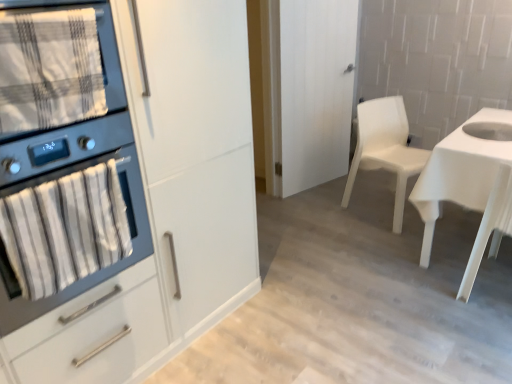
You are a GUI agent. You are given a task and a screenshot of the screen. Output one action in this format:
    pyautogui.click(x=<x>, y=<y>)
    Task: Click on the white glossy desk at right
    
    Given the screenshot: What is the action you would take?
    pyautogui.click(x=470, y=185)

The width and height of the screenshot is (512, 384). In order to click on plaid fabric towel at left in this screenshot , I will do pyautogui.click(x=49, y=69).

Where is `white matte door at center`? This screenshot has width=512, height=384. white matte door at center is located at coordinates (315, 90).

Where is `matte black oven at left`? The width and height of the screenshot is (512, 384). matte black oven at left is located at coordinates (89, 275).

Is white glossy sink at right oriented towards white matte door at center?

Yes, white glossy sink at right is oriented towards white matte door at center.

You are a GUI agent. You are given a task and a screenshot of the screen. Output one action in this format:
    pyautogui.click(x=<x>, y=<y>)
    Task: Click on the sink located on the right of white matte door at center
    The image size is (512, 384).
    Given the screenshot: What is the action you would take?
    pyautogui.click(x=489, y=131)

Can you confirm if white glossy sink at right is smaller than white matte door at center?

Indeed, white glossy sink at right has a smaller size compared to white matte door at center.

Would you say white glossy sink at right is a long distance from white matte door at center?

That's right, there is a large distance between white glossy sink at right and white matte door at center.

Do you think white matte cabinet at left is within plaid fabric towel at left, or outside of it?

white matte cabinet at left exists outside the volume of plaid fabric towel at left.

Relative to plaid fabric towel at left, is white matte cabinet at left in front or behind?

Visually, white matte cabinet at left is located in front of plaid fabric towel at left.

Is white matte cabinet at left next to plaid fabric towel at left and touching it?

No.

Find the location of a particular element. blanket to the left of white glossy sink at right is located at coordinates (49, 69).

Does point (48, 123) lie behind point (472, 128)?

No.

Is plaid fabric towel at left wider or thinner than white glossy sink at right?

Considering their sizes, plaid fabric towel at left looks slimmer than white glossy sink at right.

Is white glossy sink at right at the back of plaid fabric towel at left?

No, white glossy sink at right is not at the back of plaid fabric towel at left.

Is white plastic chair at center-right oriented towards white matte cabinet at left?

No, white plastic chair at center-right is not turned towards white matte cabinet at left.

Considering the relative sizes of white plastic chair at center-right and white matte cabinet at left in the image provided, is white plastic chair at center-right taller than white matte cabinet at left?

No.

From the image's perspective, is white plastic chair at center-right over white matte cabinet at left?

Correct, white plastic chair at center-right appears higher than white matte cabinet at left in the image.

Consider the image. Does white plastic chair at center-right come behind white matte cabinet at left?

Yes, it is.

Is matte black oven at left far away from white plastic chair at center-right?

matte black oven at left is far away from white plastic chair at center-right.

From the image's perspective, which one is positioned lower, matte black oven at left or white plastic chair at center-right?

matte black oven at left.

Is matte black oven at left closer to camera compared to white plastic chair at center-right?

Yes, it is.

Is matte black oven at left spatially inside white plastic chair at center-right, or outside of it?

The correct answer is: outside.

Based on the photo, from the image's perspective, would you say white matte cabinet at left is positioned over white glossy desk at right?

Indeed, from the image's perspective, white matte cabinet at left is shown above white glossy desk at right.

Can you confirm if white matte cabinet at left is thinner than white glossy desk at right?

No, white matte cabinet at left is not thinner than white glossy desk at right.

Is point (205, 17) behind point (478, 263)?

No, it is not.

From a real-world perspective, who is located higher, white matte cabinet at left or white glossy desk at right?

From a 3D spatial view, white matte cabinet at left is above.

Does matte black oven at left turn towards white matte cabinet at left?

Yes, matte black oven at left is turned towards white matte cabinet at left.

Which is more to the right, matte black oven at left or white matte cabinet at left?

Positioned to the right is white matte cabinet at left.

How many degrees apart are the facing directions of matte black oven at left and white matte cabinet at left?

The angle between the facing direction of matte black oven at left and the facing direction of white matte cabinet at left is 0.000998 degrees.

Is matte black oven at left not close to white matte cabinet at left?

No, matte black oven at left is not far from white matte cabinet at left.

The height and width of the screenshot is (384, 512). I want to click on sink in front of the white matte door at center, so click(x=489, y=131).

This screenshot has width=512, height=384. I want to click on blanket on the left of the white matte cabinet at left, so [x=49, y=69].

Estimate the real-world distances between objects in this image. Which object is closer to white glossy desk at right, matte black oven at left or white matte cabinet at left?

white matte cabinet at left lies closer to white glossy desk at right than the other object.

When comparing their distances from white matte cabinet at left, does white glossy desk at right or plaid fabric towel at left seem closer?

The object closer to white matte cabinet at left is plaid fabric towel at left.

Looking at the image, which one is located closer to white matte door at center, white glossy desk at right or plaid fabric towel at left?

white glossy desk at right lies closer to white matte door at center than the other object.

Looking at the image, which one is located further to white glossy sink at right, matte black oven at left or white glossy desk at right?

matte black oven at left.

Looking at the image, which one is located further to white plastic chair at center-right, plaid fabric towel at left or white glossy sink at right?

Among the two, plaid fabric towel at left is located further to white plastic chair at center-right.

Estimate the real-world distances between objects in this image. Which object is further from white glossy desk at right, white glossy sink at right or plaid fabric towel at left?

plaid fabric towel at left is positioned further to the anchor white glossy desk at right.

Looking at this image, estimate the real-world distances between objects in this image. Which object is closer to plaid fabric towel at left, white glossy sink at right or matte black oven at left?

The object closer to plaid fabric towel at left is matte black oven at left.

From the image, which object appears to be farther from white matte door at center, white glossy desk at right or white matte cabinet at left?

white matte cabinet at left is further to white matte door at center.

This screenshot has height=384, width=512. In order to click on chair between plaid fabric towel at left and white matte door at center from front to back in this screenshot , I will do `click(385, 149)`.

Find the location of a particular element. The width and height of the screenshot is (512, 384). kitchen appliance between plaid fabric towel at left and white matte cabinet at left in the vertical direction is located at coordinates (89, 275).

Find the location of a particular element. The height and width of the screenshot is (384, 512). cabinetry between plaid fabric towel at left and white glossy desk at right in the horizontal direction is located at coordinates (121, 183).

In order to click on chair located between white matte cabinet at left and white glossy sink at right in the left-right direction in this screenshot , I will do `click(385, 149)`.